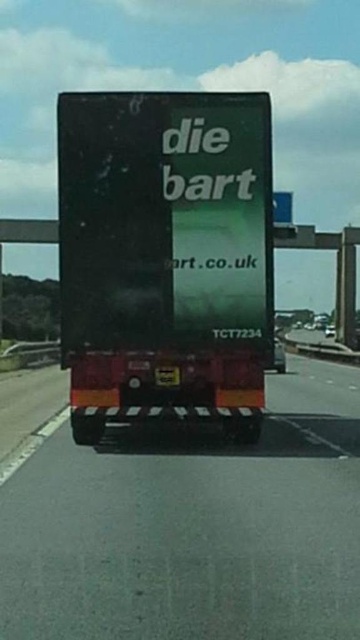
Is black rubber truck at center below matte black truck at center?

Correct, black rubber truck at center is located below matte black truck at center.

Is point (55, 483) behind point (234, 280)?

No.

The height and width of the screenshot is (640, 360). Identify the location of black rubber truck at center. (192, 525).